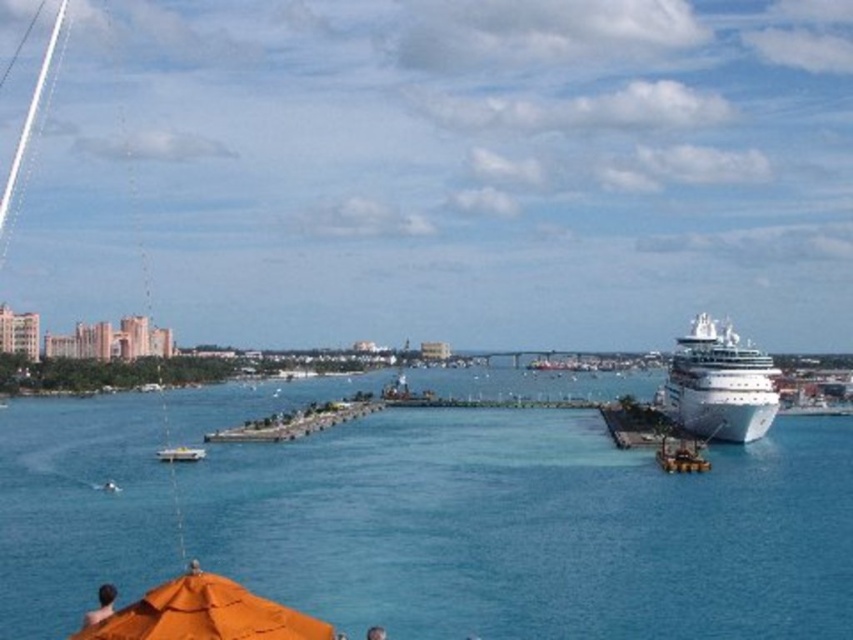
Who is lower down, orange fabric umbrella at lower left or white concrete dock at right?

Positioned lower is orange fabric umbrella at lower left.

Based on the photo, does orange fabric umbrella at lower left appear over white concrete dock at right?

No, orange fabric umbrella at lower left is not above white concrete dock at right.

This screenshot has height=640, width=853. What do you see at coordinates (204, 612) in the screenshot? I see `orange fabric umbrella at lower left` at bounding box center [204, 612].

Find the location of a particular element. The height and width of the screenshot is (640, 853). orange fabric umbrella at lower left is located at coordinates (204, 612).

Describe the element at coordinates (296, 420) in the screenshot. I see `concrete pier at center` at that location.

Which is more to the left, concrete pier at center or white concrete dock at right?

concrete pier at center is more to the left.

Does point (350, 401) lie behind point (610, 433)?

Yes.

The image size is (853, 640). I want to click on concrete pier at center, so click(296, 420).

Who is more distant from viewer, (724, 432) or (281, 428)?

The point (281, 428) is behind.

Can you confirm if white glossy cruise ship at right is wider than concrete pier at center?

Incorrect, white glossy cruise ship at right's width does not surpass concrete pier at center's.

Is point (741, 392) behind point (306, 406)?

No, it is not.

The image size is (853, 640). In order to click on white glossy cruise ship at right in this screenshot , I will do `click(718, 385)`.